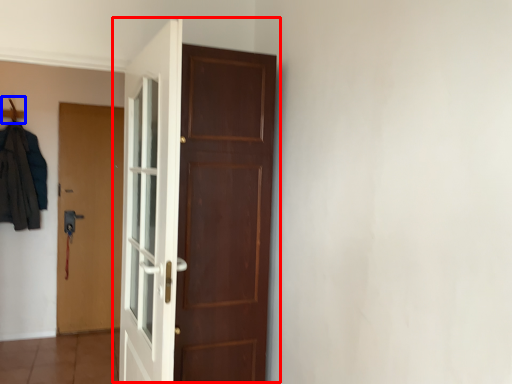
Question: Which object is closer to the camera taking this photo, door (highlighted by a red box) or hanger (highlighted by a blue box)?

Choices:
 (A) door
 (B) hanger

Answer: (A)